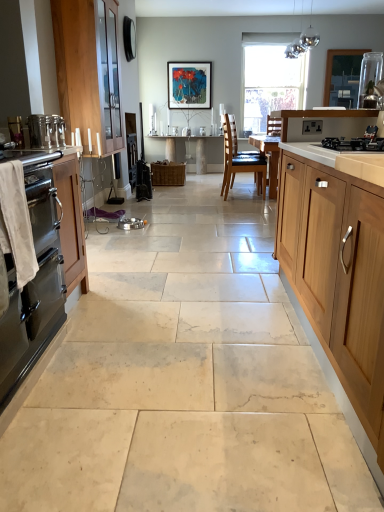
At what (x,y) coordinates should I click in order to perform the action: click on satin black oven at left, which is the second cabinetry in front-to-back order. Please return your answer as a coordinate pair (x, y). Looking at the image, I should click on (38, 271).

Describe the element at coordinates (343, 77) in the screenshot. I see `clear glass jar at upper right` at that location.

Where is `clear glass jar at upper right`? This screenshot has height=512, width=384. clear glass jar at upper right is located at coordinates (343, 77).

The width and height of the screenshot is (384, 512). What do you see at coordinates (302, 42) in the screenshot? I see `glossy metallic light fixture at upper center` at bounding box center [302, 42].

Measure the distance between clear glass vase at upper right, the 3th appliance from the front, and camera.

clear glass vase at upper right, the 3th appliance from the front, is 19.66 feet from camera.

Find the location of a particular element. The height and width of the screenshot is (512, 384). clear glass vase at upper right, the 3th appliance from the front is located at coordinates (369, 74).

This screenshot has width=384, height=512. Find the location of `satin black oven at left, which is the second cabinetry in front-to-back order`. satin black oven at left, which is the second cabinetry in front-to-back order is located at coordinates (38, 271).

Between point (335, 91) and point (358, 102), which one is positioned behind?

The point (335, 91) is farther from the camera.

Where is `window screen above the clear glass vase at upper right, the 1th appliance positioned from the top (from the image's perspective)`? The height and width of the screenshot is (512, 384). window screen above the clear glass vase at upper right, the 1th appliance positioned from the top (from the image's perspective) is located at coordinates (343, 77).

Which object is closer to the camera taking this photo, clear glass jar at upper right or clear glass vase at upper right, positioned as the third appliance in bottom-to-top order?

clear glass vase at upper right, positioned as the third appliance in bottom-to-top order, is closer to the camera.

Considering the points (21, 134) and (344, 51), which point is in front, point (21, 134) or point (344, 51)?

The point (21, 134) is in front.

Considering the sizes of objects metallic stainless steel oven at left, the 2th appliance in the front-to-back sequence, and clear glass jar at upper right in the image provided, who is bigger, metallic stainless steel oven at left, the 2th appliance in the front-to-back sequence, or clear glass jar at upper right?

clear glass jar at upper right is bigger.

Is metallic stainless steel oven at left, which is the 3th appliance in right-to-left order, completely or partially outside of clear glass jar at upper right?

Indeed, metallic stainless steel oven at left, which is the 3th appliance in right-to-left order, is completely outside clear glass jar at upper right.

Is transparent glass window at center in contact with satin silver countertop at left?

No.

Does point (283, 37) come behind point (2, 156)?

Yes, it is.

From the image's perspective, between transparent glass window at center and satin silver countertop at left, who is located below?

From the image's view, satin silver countertop at left is below.

Is satin silver countertop at left at the back of transparent glass window at center?

No, satin silver countertop at left is not at the back of transparent glass window at center.

Does point (104, 101) appear closer or farther from the camera than point (333, 67)?

Point (104, 101) is positioned closer to the camera compared to point (333, 67).

Can you confirm if wooden cabinet at left, the first cabinetry from the left, is positioned to the left of clear glass jar at upper right?

Yes.

Between wooden cabinet at left, the first cabinetry from the left, and clear glass jar at upper right, which one has smaller width?

clear glass jar at upper right.

Considering the sizes of objects wooden cabinet at left, acting as the third cabinetry starting from the right, and clear glass jar at upper right in the image provided, who is smaller, wooden cabinet at left, acting as the third cabinetry starting from the right, or clear glass jar at upper right?

With smaller size is clear glass jar at upper right.

Does transparent glass window at center appear on the left side of black matte gas stove at upper right?

No, transparent glass window at center is not to the left of black matte gas stove at upper right.

Looking at this image, is transparent glass window at center located outside black matte gas stove at upper right?

Yes, transparent glass window at center is located beyond the bounds of black matte gas stove at upper right.

Is point (266, 116) closer or farther from the camera than point (378, 146)?

Point (266, 116) appears to be farther away from the viewer than point (378, 146).

Considering the sizes of objects transparent glass window at center and black matte gas stove at upper right in the image provided, who is wider, transparent glass window at center or black matte gas stove at upper right?

black matte gas stove at upper right.

Considering the sizes of objects transparent glass window at center and wooden cabinet at right, which ranks as the 3th cabinetry in left-to-right order, in the image provided, who is thinner, transparent glass window at center or wooden cabinet at right, which ranks as the 3th cabinetry in left-to-right order,?

Thinner between the two is transparent glass window at center.

In terms of height, does transparent glass window at center look taller or shorter compared to wooden cabinet at right, marked as the first cabinetry in a front-to-back arrangement?

transparent glass window at center is taller than wooden cabinet at right, marked as the first cabinetry in a front-to-back arrangement.

Looking at this image, from the image's perspective, is transparent glass window at center above or below wooden cabinet at right, the 1th cabinetry from the right?

Based on their image positions, transparent glass window at center is located above wooden cabinet at right, the 1th cabinetry from the right.

Considering the positions of objects transparent glass window at center and wooden cabinet at right, which ranks as the 3th cabinetry in left-to-right order, in the image provided, who is more to the left, transparent glass window at center or wooden cabinet at right, which ranks as the 3th cabinetry in left-to-right order,?

Positioned to the left is wooden cabinet at right, which ranks as the 3th cabinetry in left-to-right order.

Find the location of a particular element. Image resolution: width=384 pixels, height=512 pixels. window behind the satin silver toaster at left, which ranks as the second appliance in left-to-right order is located at coordinates (269, 78).

Is transparent glass window at center at the back of satin silver toaster at left, which appears as the first appliance when viewed from the front?

satin silver toaster at left, which appears as the first appliance when viewed from the front, does not have its back to transparent glass window at center.

Is satin silver toaster at left, the second appliance positioned from the bottom, not inside transparent glass window at center?

Yes, satin silver toaster at left, the second appliance positioned from the bottom, is not within transparent glass window at center.

From a real-world perspective, is satin silver toaster at left, which appears as the first appliance when viewed from the front, on top of transparent glass window at center?

Actually, satin silver toaster at left, which appears as the first appliance when viewed from the front, is physically below transparent glass window at center in the real world.

I want to click on window screen above the clear glass vase at upper right, positioned as the third appliance in bottom-to-top order (from the image's perspective), so click(x=343, y=77).

There is a clear glass jar at upper right. In order to click on the 3rd appliance below it (from a real-world perspective) in this screenshot , I will do [x=16, y=130].

Looking at the image, which one is located closer to metallic stainless steel oven at left, marked as the 1th appliance in a left-to-right arrangement, clear glass jar at upper right or satin silver countertop at left?

satin silver countertop at left.

Which object lies further to the anchor point matte wooden picture frame at center, clear glass vase at upper right, which is counted as the 1th appliance, starting from the back, or glossy metallic light fixture at upper center?

clear glass vase at upper right, which is counted as the 1th appliance, starting from the back, lies further to matte wooden picture frame at center than the other object.

From the image, which object appears to be nearer to light brown wood chair at center, transparent glass window at center or clear glass jar at upper right?

transparent glass window at center is closer to light brown wood chair at center.

Which object lies further to the anchor point glossy metallic light fixture at upper center, wooden cabinet at left, acting as the third cabinetry starting from the right, or satin silver toaster at left, which ranks as the second appliance in left-to-right order?

The object further to glossy metallic light fixture at upper center is satin silver toaster at left, which ranks as the second appliance in left-to-right order.

From the image, which object appears to be nearer to satin silver toaster at left, the 3th appliance when ordered from back to front, wooden cabinet at left, the first cabinetry from the left, or white marble table at center?

wooden cabinet at left, the first cabinetry from the left, is closer to satin silver toaster at left, the 3th appliance when ordered from back to front.

Based on their spatial positions, is satin silver countertop at left or satin black oven at left, the 2th cabinetry positioned from the right, closer to glossy metallic light fixture at upper center?

satin silver countertop at left lies closer to glossy metallic light fixture at upper center than the other object.

Estimate the real-world distances between objects in this image. Which object is closer to metallic stainless steel oven at left, which is the 3th appliance in top-to-bottom order, transparent glass window at center or white marble table at center?

Among the two, white marble table at center is located nearer to metallic stainless steel oven at left, which is the 3th appliance in top-to-bottom order.

When comparing their distances from white marble table at center, does metallic stainless steel oven at left, the 2th appliance in the front-to-back sequence, or wooden cabinet at right, the third cabinetry from the back, seem further?

metallic stainless steel oven at left, the 2th appliance in the front-to-back sequence, lies further to white marble table at center than the other object.

You are a GUI agent. You are given a task and a screenshot of the screen. Output one action in this format:
    pyautogui.click(x=<x>, y=<y>)
    Task: Click on the light fixture between black matte gas stove at upper right and light brown wood chair at center along the z-axis
    This screenshot has width=384, height=512.
    Given the screenshot: What is the action you would take?
    302,42

Identify the location of light fixture between wooden cabinet at right, the third cabinetry from the back, and transparent glass window at center from front to back. This screenshot has width=384, height=512. (302, 42).

Where is `chair between satin silver toaster at left, the 3th appliance when ordered from back to front, and transparent glass window at center, along the z-axis`? chair between satin silver toaster at left, the 3th appliance when ordered from back to front, and transparent glass window at center, along the z-axis is located at coordinates (240, 160).

Identify the location of cabinetry between wooden cabinet at right, which ranks as the 3th cabinetry in left-to-right order, and wooden cabinet at left, marked as the third cabinetry in a front-to-back arrangement, along the z-axis. (38, 271).